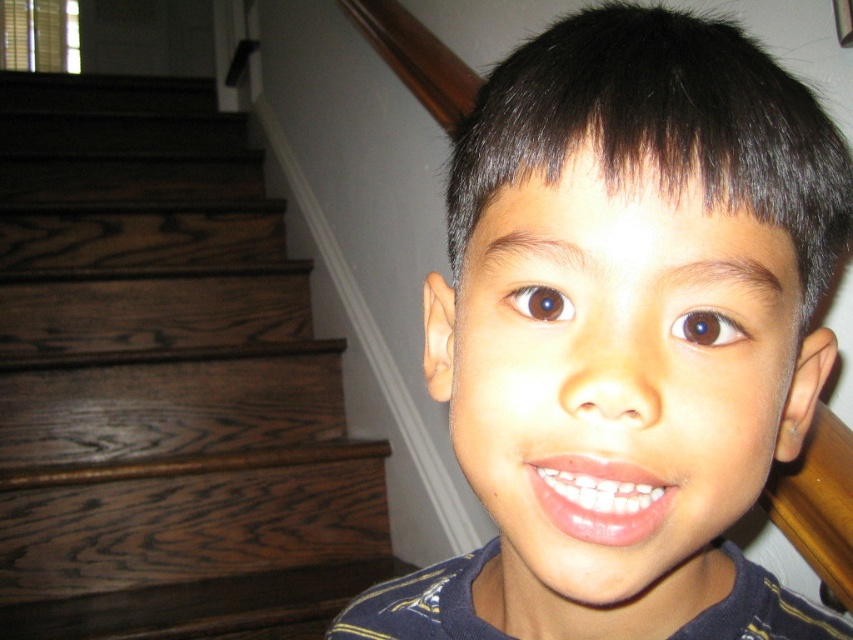
You are a photographer adjusting your camera to focus on the smooth skin face at center and the dark brown wood stairs at left. Which object is positioned higher in the image?

The smooth skin face at center is located above the dark brown wood stairs at left, so it is positioned higher in the image.